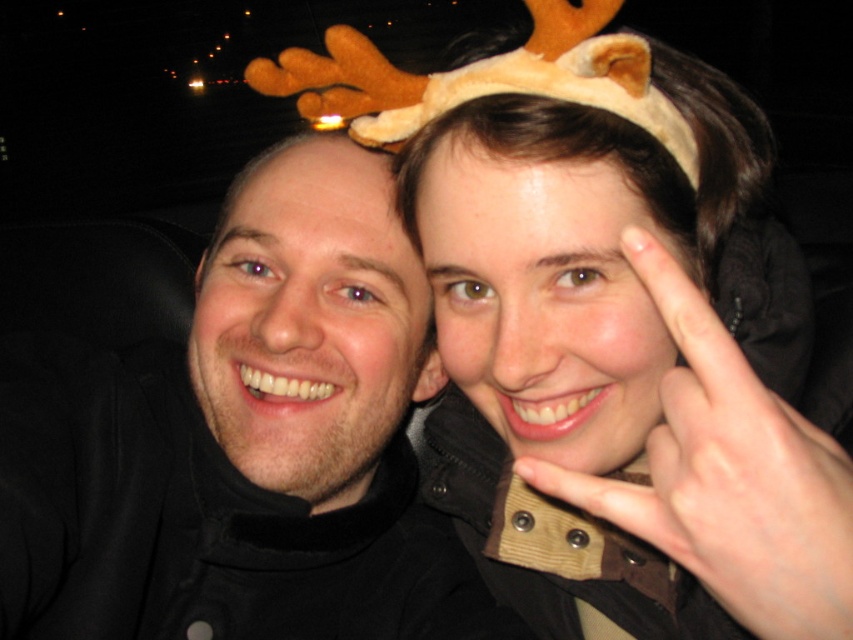
You are a photographer adjusting the lighting in a vehicle. You need to position a spotlight at point (616, 374) to highlight an object. Which object should you focus the spotlight on?

The fuzzy brown headband at upper center is located at point 0.723, so you should focus the spotlight on the fuzzy brown headband at upper center.

You are a photographer trying to capture a closeup shot of the fuzzy brown headband at upper center and the matte black hair at left. Since the camera can only focus on one object at a time, which object should you focus on to ensure it appears larger in the photo?

The fuzzy brown headband at upper center is bigger than the matte black hair at left, so you should focus on the fuzzy brown headband at upper center to ensure it appears larger in the photo.